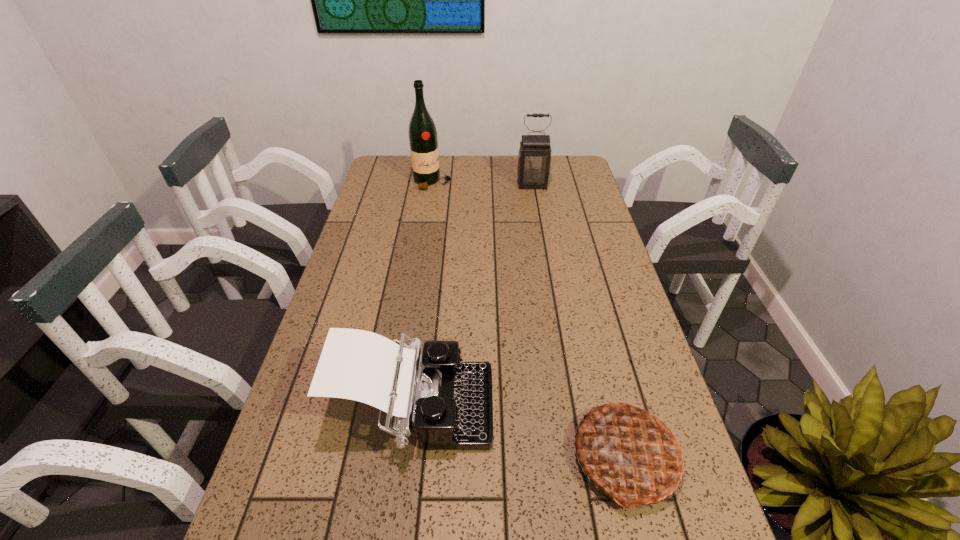
The image size is (960, 540). What are the coordinates of `the tallest object` in the screenshot? It's located at (423, 141).

Where is `lantern`? The image size is (960, 540). lantern is located at coordinates (534, 159).

Image resolution: width=960 pixels, height=540 pixels. I want to click on typewriter, so click(450, 401).

Image resolution: width=960 pixels, height=540 pixels. In order to click on pie in this screenshot , I will do `click(627, 451)`.

Identify the location of free location located on the front of the tallest object. The image size is (960, 540). (429, 205).

Where is `vacant space located 0.060m on the front-facing side of the lantern`? The image size is (960, 540). vacant space located 0.060m on the front-facing side of the lantern is located at coordinates (535, 199).

The width and height of the screenshot is (960, 540). I want to click on free space located 0.350m on the keys of the typewriter, so click(x=654, y=410).

Identify the location of blank space located on the back of the pie. Image resolution: width=960 pixels, height=540 pixels. (606, 380).

Where is `wine bottle that is at the far edge`? wine bottle that is at the far edge is located at coordinates (423, 141).

This screenshot has width=960, height=540. I want to click on lantern present at the far edge, so click(x=534, y=159).